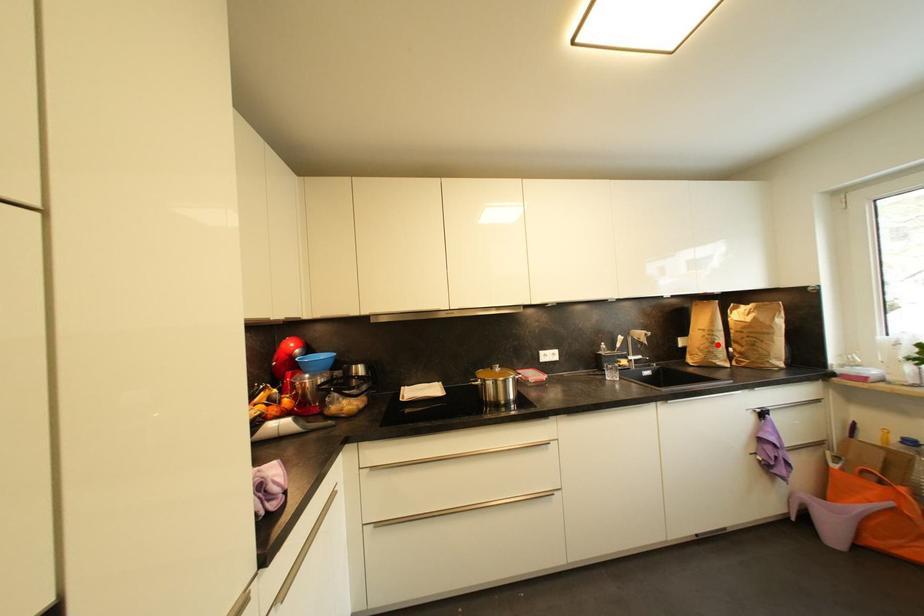
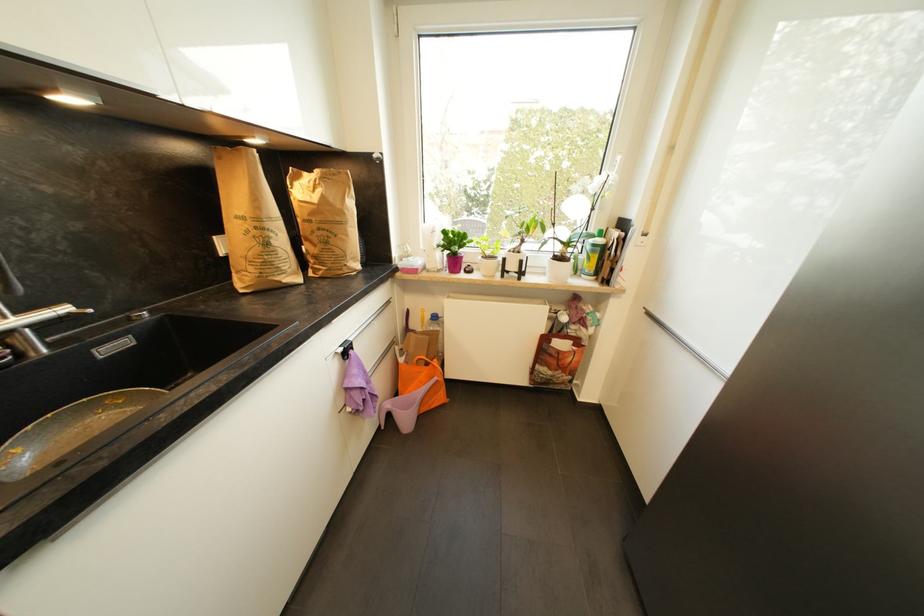
In the second image, find the point that corresponds to the highlighted location in the first image.

(272, 246)